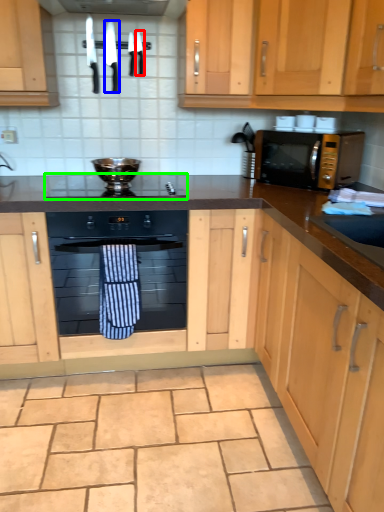
Question: Which object is the closest to the knife (highlighted by a red box)? Choose among these: knife (highlighted by a blue box) or gas stove (highlighted by a green box).

Choices:
 (A) knife
 (B) gas stove

Answer: (A)